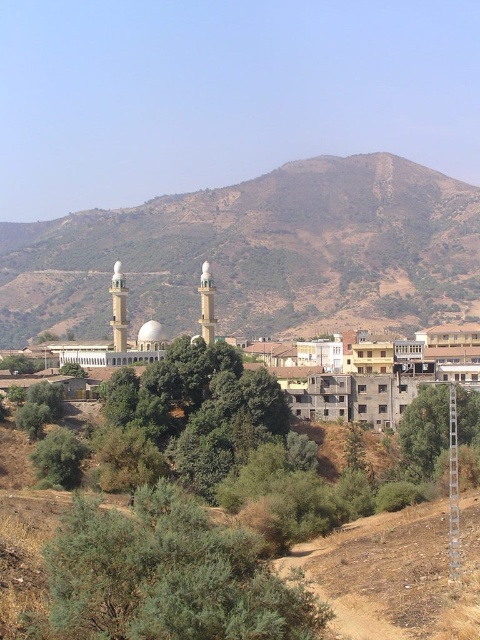
Question: Does brown/dry soil hillside at center have a larger size compared to green leafy bush at lower center?

Choices:
 (A) no
 (B) yes

Answer: (B)

Question: Which of the following is the farthest from the observer?

Choices:
 (A) (464, 440)
 (B) (78, 481)
 (C) (171, 524)

Answer: (A)

Question: Which object is positioned closest to the brown/dry soil hillside at center?

Choices:
 (A) green leafy tree at center
 (B) green leafy bush at lower center

Answer: (A)

Question: Can you confirm if brown/dry soil hillside at center is positioned above green leafy bush at lower center?

Choices:
 (A) no
 (B) yes

Answer: (B)

Question: Which object is the farthest from the green leafy bush at lower center?

Choices:
 (A) green leafy tree at lower left
 (B) brown/dry soil hillside at center
 (C) green leafy tree at center

Answer: (B)

Question: Does green leafy bush at lower center have a lesser width compared to green leafy tree at lower left?

Choices:
 (A) yes
 (B) no

Answer: (B)